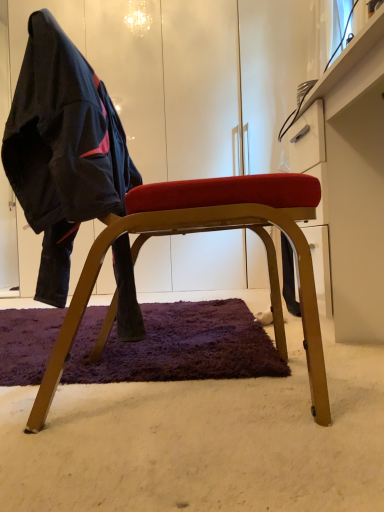
Describe the element at coordinates (63, 150) in the screenshot. I see `matte black jacket at left` at that location.

You are a GUI agent. You are given a task and a screenshot of the screen. Output one action in this format:
    pyautogui.click(x=<x>, y=<y>)
    Task: Click on the matte black jacket at left
    This screenshot has height=512, width=384.
    Given the screenshot: What is the action you would take?
    pyautogui.click(x=63, y=150)

In the scene shown: Is matte black jacket at left inside or outside of white glossy dresser at upper right?

matte black jacket at left cannot be found inside white glossy dresser at upper right.

From the image's perspective, does matte black jacket at left appear higher than white glossy dresser at upper right?

Correct, matte black jacket at left appears higher than white glossy dresser at upper right in the image.

Which of these two, matte black jacket at left or white glossy dresser at upper right, is bigger?

white glossy dresser at upper right.

Where is `person that appears on the left of white glossy dresser at upper right`? This screenshot has height=512, width=384. person that appears on the left of white glossy dresser at upper right is located at coordinates (63, 150).

Is matte black jacket at left bigger than wooden chair at center?

Incorrect, matte black jacket at left is not larger than wooden chair at center.

In the image, is matte black jacket at left on the left side or the right side of wooden chair at center?

matte black jacket at left is positioned on wooden chair at center's left side.

From a real-world perspective, is matte black jacket at left positioned under wooden chair at center based on gravity?

No, from a real-world perspective, matte black jacket at left is not below wooden chair at center.

From the image's perspective, is matte black jacket at left on wooden chair at center?

Yes, from the image's perspective, matte black jacket at left is above wooden chair at center.

I want to click on person above the white glossy dresser at upper right (from a real-world perspective), so click(x=63, y=150).

Which of these two, white glossy dresser at upper right or matte black jacket at left, is thinner?

Thinner between the two is matte black jacket at left.

How different are the orientations of white glossy dresser at upper right and matte black jacket at left in degrees?

178 degrees.

Is white glossy dresser at upper right turned away from matte black jacket at left?

white glossy dresser at upper right does not have its back to matte black jacket at left.

From a real-world perspective, is wooden chair at center positioned under matte black jacket at left based on gravity?

Indeed, from a real-world perspective, wooden chair at center is positioned beneath matte black jacket at left.

Is wooden chair at center looking in the opposite direction of matte black jacket at left?

That's right, wooden chair at center is facing away from matte black jacket at left.

From the image's perspective, relative to matte black jacket at left, is wooden chair at center above or below?

wooden chair at center is below matte black jacket at left.

In the image, is wooden chair at center positioned in front of or behind matte black jacket at left?

Clearly, wooden chair at center is behind matte black jacket at left.

Is white glossy dresser at upper right placed right next to wooden chair at center?

white glossy dresser at upper right and wooden chair at center are not in contact.

How much distance is there between white glossy dresser at upper right and wooden chair at center?

white glossy dresser at upper right is 14.92 inches from wooden chair at center.

From their relative heights in the image, would you say white glossy dresser at upper right is taller or shorter than wooden chair at center?

Considering their sizes, white glossy dresser at upper right has less height than wooden chair at center.

From the image's perspective, is wooden chair at center below white glossy dresser at upper right?

Indeed, from the image's perspective, wooden chair at center is shown beneath white glossy dresser at upper right.

Does wooden chair at center have a lesser width compared to white glossy dresser at upper right?

Incorrect, the width of wooden chair at center is not less than that of white glossy dresser at upper right.

Does wooden chair at center have a larger size compared to white glossy dresser at upper right?

Incorrect, wooden chair at center is not larger than white glossy dresser at upper right.

The height and width of the screenshot is (512, 384). In order to click on dresser on the right side of matte black jacket at left in this screenshot , I will do `click(349, 178)`.

Locate an element on the screen. chair below the matte black jacket at left (from a real-world perspective) is located at coordinates (205, 231).

Estimate the real-world distances between objects in this image. Which object is closer to wooden chair at center, matte black jacket at left or white glossy dresser at upper right?

Among the two, matte black jacket at left is located nearer to wooden chair at center.

When comparing their distances from wooden chair at center, does white glossy dresser at upper right or matte black jacket at left seem further?

Based on the image, white glossy dresser at upper right appears to be further to wooden chair at center.

Considering their positions, is matte black jacket at left positioned closer to white glossy dresser at upper right than wooden chair at center?

wooden chair at center.

Estimate the real-world distances between objects in this image. Which object is further from matte black jacket at left, white glossy dresser at upper right or wooden chair at center?

The object further to matte black jacket at left is white glossy dresser at upper right.

When comparing their distances from white glossy dresser at upper right, does wooden chair at center or matte black jacket at left seem further?

matte black jacket at left lies further to white glossy dresser at upper right than the other object.

From the image, which object appears to be nearer to matte black jacket at left, wooden chair at center or white glossy dresser at upper right?

Among the two, wooden chair at center is located nearer to matte black jacket at left.

You are a GUI agent. You are given a task and a screenshot of the screen. Output one action in this format:
    pyautogui.click(x=<x>, y=<y>)
    Task: Click on the chair located between matte black jacket at left and white glossy dresser at upper right in the left-right direction
    The height and width of the screenshot is (512, 384).
    Given the screenshot: What is the action you would take?
    pyautogui.click(x=205, y=231)